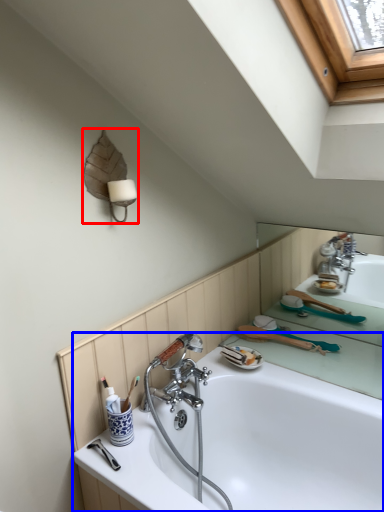
Question: Which object is further to the camera taking this photo, lamp (highlighted by a red box) or bathtub (highlighted by a blue box)?

Choices:
 (A) lamp
 (B) bathtub

Answer: (A)